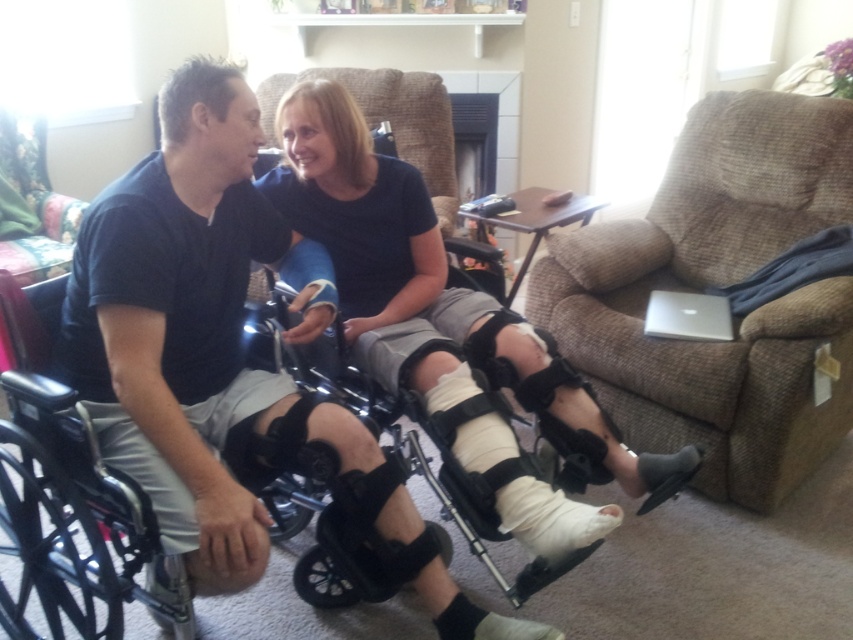
You are a physical therapist planning to move a 1.2 meter wide exercise mat between the brown fabric armchair at right and the black plastic wheelchair at left. Can the exercise mat fit through the space between them?

The brown fabric armchair at right is to the right of the black plastic wheelchair at left. Since the exercise mat is 1.2 meters wide, we need to know the distance between them. However, the description only states their relative positions, not the actual distance. Without knowing the exact space between them, it is impossible to determine if the exercise mat will fit.

You are a physical therapist preparing to move a patient from the brown fabric armchair at right to the white matte plaster bandage at lower center. Which object is taller, requiring you to adjust your approach when transferring the patient?

The brown fabric armchair at right is taller than the white matte plaster bandage at lower center, so you need to adjust your approach to account for the height difference between the two.

You are a physical therapist observing the white bandaged leg at center. Based on its coordinates, can you determine if it is positioned closer to the left or right side of the room?

The white bandaged leg at center is located at coordinates point (432, 294), which places it near the center of the room. Therefore, it is neither closer to the left nor the right side of the room.